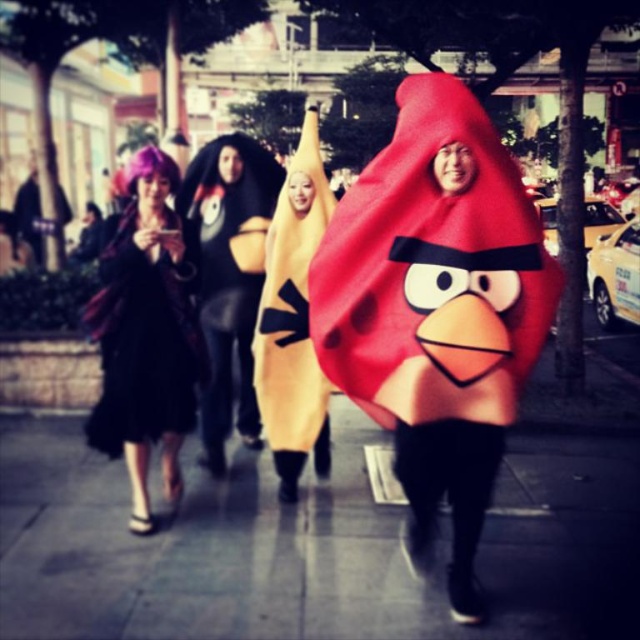
Based on the photo, who is positioned more to the left, smooth concrete pavement at center or matte red costume at center?

From the viewer's perspective, smooth concrete pavement at center appears more on the left side.

Is smooth concrete pavement at center to the left of matte red costume at center from the viewer's perspective?

Correct, you'll find smooth concrete pavement at center to the left of matte red costume at center.

Is point (205, 524) behind point (339, 328)?

Yes, it is.

Image resolution: width=640 pixels, height=640 pixels. Identify the location of smooth concrete pavement at center. (308, 545).

Which is below, matte red costume at center or purple fabric dress at left?

Positioned lower is matte red costume at center.

Is matte red costume at center in front of purple fabric dress at left?

That is True.

Which is in front, point (476, 115) or point (104, 282)?

Point (476, 115) is more forward.

This screenshot has width=640, height=640. I want to click on matte red costume at center, so click(x=435, y=308).

Can you confirm if smooth concrete pavement at center is shorter than purple fabric dress at left?

Yes, smooth concrete pavement at center is shorter than purple fabric dress at left.

Does smooth concrete pavement at center have a larger size compared to purple fabric dress at left?

Correct, smooth concrete pavement at center is larger in size than purple fabric dress at left.

The height and width of the screenshot is (640, 640). What do you see at coordinates (308, 545) in the screenshot?
I see `smooth concrete pavement at center` at bounding box center [308, 545].

Where is `smooth concrete pavement at center`? The width and height of the screenshot is (640, 640). smooth concrete pavement at center is located at coordinates (308, 545).